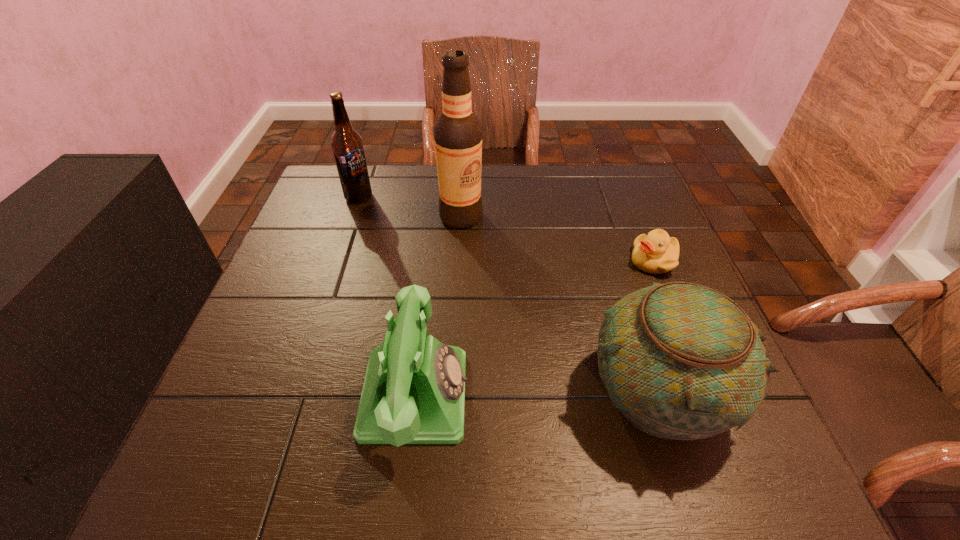
Point out which object is positioned as the nearest to the alcohol. Please provide its 2D coordinates. Your answer should be formatted as a tuple, i.e. [(x, y)], where the tuple contains the x and y coordinates of a point satisfying the conditions above.

[(346, 143)]

The width and height of the screenshot is (960, 540). Identify the location of vacant space that satisfies the following two spatial constraints: 1. on the front side of the pottery; 2. on the left side of the alcohol. (452, 390).